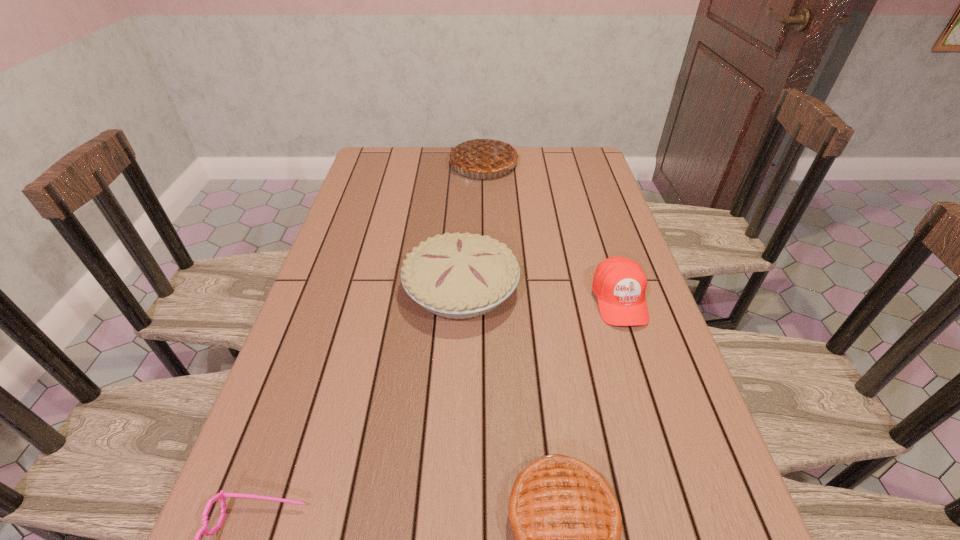
In the image, there is a desktop. Identify the location of vacant space at the left edge. Image resolution: width=960 pixels, height=540 pixels. (357, 346).

This screenshot has height=540, width=960. In the image, there is a desktop. In order to click on vacant space at the right edge in this screenshot , I will do click(x=671, y=351).

In the image, there is a desktop. Where is `vacant region at the far right corner`? The image size is (960, 540). vacant region at the far right corner is located at coordinates (558, 168).

The image size is (960, 540). Identify the location of blank region between the second shortest pie and the farthest object. (472, 226).

This screenshot has width=960, height=540. Identify the location of vacant region between the farthest pie and the baseball cap. (551, 232).

Find the location of a particular element. The width and height of the screenshot is (960, 540). object that ranks as the third closest to the tallest pie is located at coordinates (567, 524).

Locate which object ranks second in proximity to the second nearest pie. Please provide its 2D coordinates. Your answer should be formatted as a tuple, i.e. [(x, y)], where the tuple contains the x and y coordinates of a point satisfying the conditions above.

[(567, 524)]

Identify which pie is the second nearest to the fourth tallest object. Please provide its 2D coordinates. Your answer should be formatted as a tuple, i.e. [(x, y)], where the tuple contains the x and y coordinates of a point satisfying the conditions above.

[(485, 154)]

Identify which pie is the second nearest to the shortest pie. Please provide its 2D coordinates. Your answer should be formatted as a tuple, i.e. [(x, y)], where the tuple contains the x and y coordinates of a point satisfying the conditions above.

[(485, 154)]

Locate an element on the screen. The height and width of the screenshot is (540, 960). vacant space that satisfies the following two spatial constraints: 1. on the back side of the second nearest pie; 2. on the left side of the farthest object is located at coordinates (467, 164).